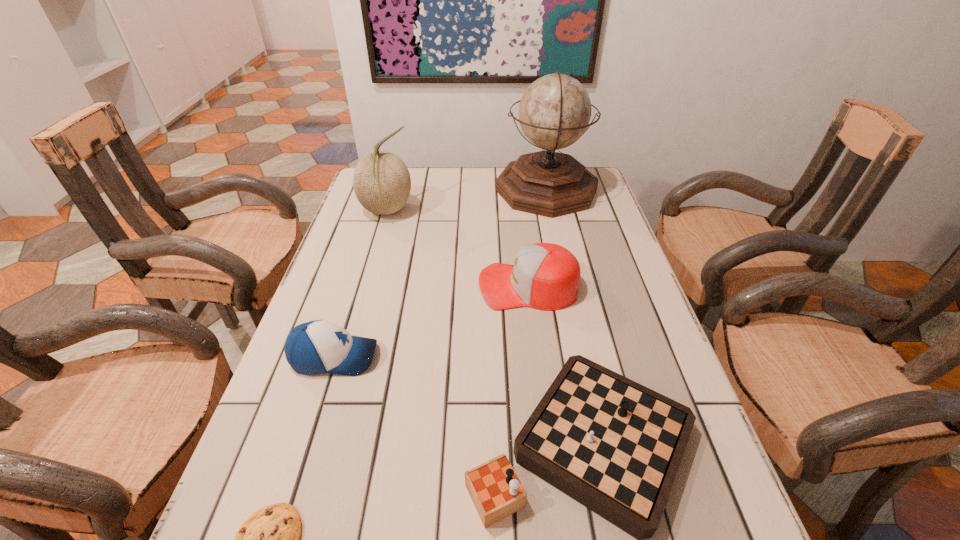
At what (x,y) coordinates should I click in order to perform the action: click on free location located on the front-facing side of the farther baseball cap. Please return your answer as a coordinate pair (x, y). This screenshot has width=960, height=540. Looking at the image, I should click on (427, 286).

Identify the location of free region located 0.240m on the front-facing side of the farther baseball cap. (383, 286).

At what (x,y) coordinates should I click in order to perform the action: click on blank space located on the front-facing side of the farther baseball cap. Please return your answer as a coordinate pair (x, y). Looking at the image, I should click on (427, 286).

Locate an element on the screen. The image size is (960, 540). vacant position located on the front-facing side of the shorter baseball cap is located at coordinates (444, 357).

Locate an element on the screen. globe present at the far edge is located at coordinates (554, 112).

Locate an element on the screen. The height and width of the screenshot is (540, 960). cantaloup positioned at the far edge is located at coordinates (381, 180).

Where is `cantaloup present at the left edge`? This screenshot has width=960, height=540. cantaloup present at the left edge is located at coordinates (381, 180).

This screenshot has height=540, width=960. I want to click on baseball cap present at the left edge, so click(x=319, y=346).

Image resolution: width=960 pixels, height=540 pixels. Find the location of `globe that is at the right edge`. globe that is at the right edge is located at coordinates (554, 112).

This screenshot has width=960, height=540. What are the coordinates of `baseball cap that is at the right edge` in the screenshot? It's located at (545, 276).